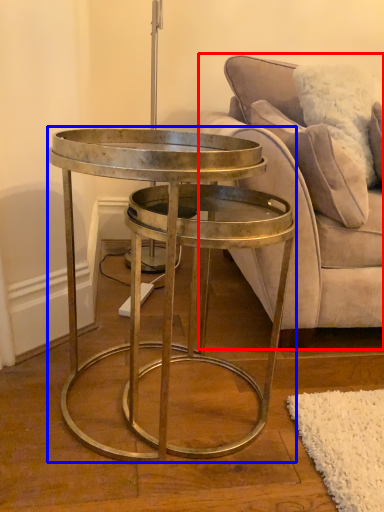
Question: Which object is further to the camera taking this photo, studio couch (highlighted by a red box) or coffee table (highlighted by a blue box)?

Choices:
 (A) studio couch
 (B) coffee table

Answer: (A)